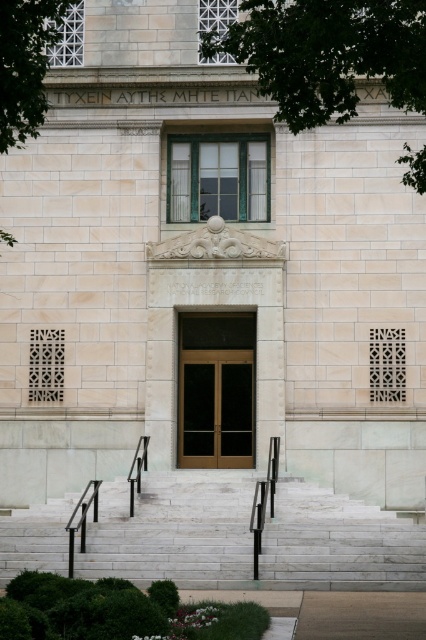
From the picture: Who is positioned more to the right, white marble stairs at lower center or green leafy tree at upper center?

green leafy tree at upper center is more to the right.

Does white marble stairs at lower center appear on the left side of green leafy tree at upper center?

Correct, you'll find white marble stairs at lower center to the left of green leafy tree at upper center.

You are a GUI agent. You are given a task and a screenshot of the screen. Output one action in this format:
    pyautogui.click(x=<x>, y=<y>)
    Task: Click on the white marble stairs at lower center
    Image resolution: width=426 pixels, height=640 pixels.
    Given the screenshot: What is the action you would take?
    pyautogui.click(x=173, y=531)

The image size is (426, 640). What are the coordinates of `white marble stairs at lower center` in the screenshot? It's located at (173, 531).

Which is in front, point (224, 540) or point (236, 381)?

Point (224, 540) is in front.

Find the location of a particular element. white marble stairs at lower center is located at coordinates (173, 531).

Who is more distant from viewer, (57, 534) or (244, 324)?

Positioned behind is point (244, 324).

Where is `white marble stairs at lower center`? white marble stairs at lower center is located at coordinates (173, 531).

Is white marble stairs at lower center to the right of green leafy tree at upper left from the viewer's perspective?

Yes, white marble stairs at lower center is to the right of green leafy tree at upper left.

Does white marble stairs at lower center have a greater height compared to green leafy tree at upper left?

Incorrect, white marble stairs at lower center's height is not larger of green leafy tree at upper left's.

Who is more forward, [178,508] or [16,120]?

Point [16,120]

You are a GUI agent. You are given a task and a screenshot of the screen. Output one action in this format:
    pyautogui.click(x=<x>, y=<y>)
    Task: Click on the white marble stairs at lower center
    
    Given the screenshot: What is the action you would take?
    pyautogui.click(x=173, y=531)